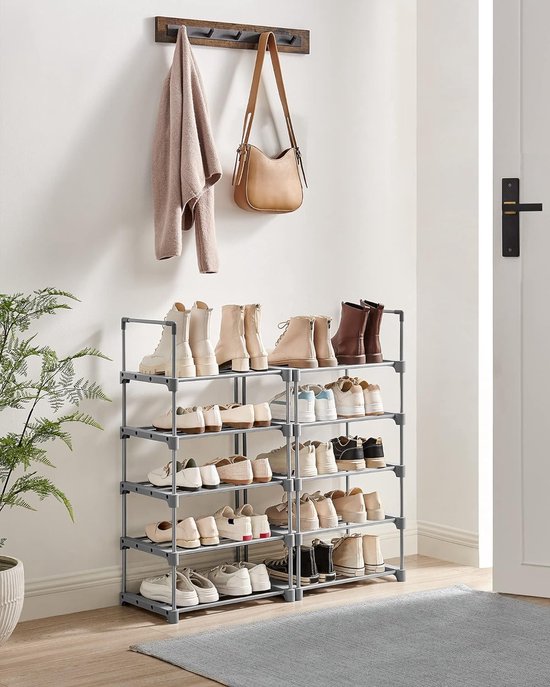
Locate an element on the screen. The image size is (550, 687). shoes on first shelf is located at coordinates (187, 607), (204, 598), (249, 587), (264, 584), (306, 569), (319, 563), (342, 559), (378, 552).